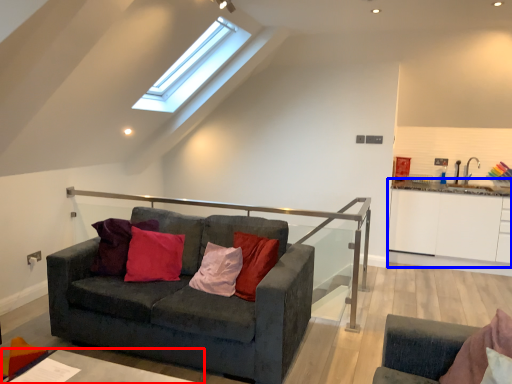
Question: Which object appears farthest to the camera in this image, table (highlighted by a red box) or cabinetry (highlighted by a blue box)?

Choices:
 (A) table
 (B) cabinetry

Answer: (B)